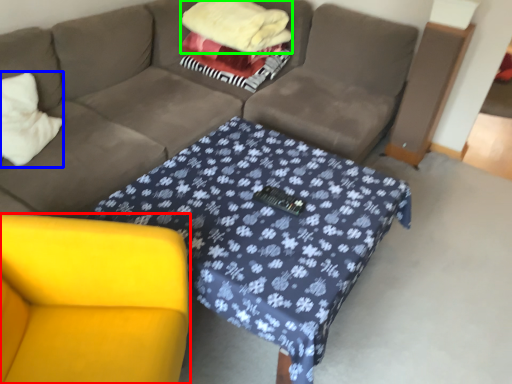
Question: Which object is positioned farthest from armchair (highlighted by a red box)? Select from throw pillow (highlighted by a blue box) and blanket (highlighted by a green box).

Choices:
 (A) throw pillow
 (B) blanket

Answer: (B)